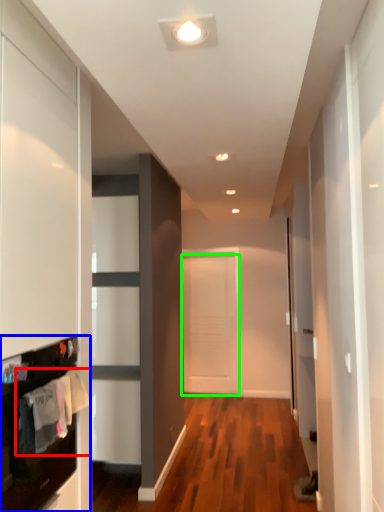
Question: Which object is positioned closest to laundry (highlighted by a red box)? Select from cabinetry (highlighted by a blue box) and door (highlighted by a green box).

Choices:
 (A) cabinetry
 (B) door

Answer: (A)